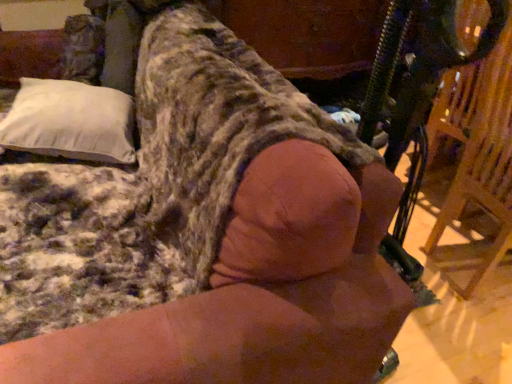
The width and height of the screenshot is (512, 384). What do you see at coordinates (70, 121) in the screenshot?
I see `white soft pillow at upper left` at bounding box center [70, 121].

Locate an element on the screen. This screenshot has width=512, height=384. white soft pillow at upper left is located at coordinates (70, 121).

Describe the element at coordinates (476, 156) in the screenshot. I see `wooden swivel chair at right` at that location.

Find the location of `wooden swivel chair at right`. wooden swivel chair at right is located at coordinates pyautogui.click(x=476, y=156).

This screenshot has width=512, height=384. Identify the location of white soft pillow at upper left. (70, 121).

Based on their positions, is white soft pillow at upper left located to the left or right of wooden swivel chair at right?

From the image, it's evident that white soft pillow at upper left is to the left of wooden swivel chair at right.

Which object is closer to the camera, white soft pillow at upper left or wooden swivel chair at right?

wooden swivel chair at right is closer to the camera.

Which is more distant, (65, 126) or (455, 128)?

The point (455, 128) is behind.

From the image's perspective, is white soft pillow at upper left below wooden swivel chair at right?

No, from the image's perspective, white soft pillow at upper left is not beneath wooden swivel chair at right.

From a real-world perspective, does white soft pillow at upper left sit lower than wooden swivel chair at right?

No.

Which object is wider, white soft pillow at upper left or wooden swivel chair at right?

With larger width is wooden swivel chair at right.

Looking at this image, which of these two, white soft pillow at upper left or wooden swivel chair at right, stands taller?

Standing taller between the two is wooden swivel chair at right.

Looking at this image, which of these two, white soft pillow at upper left or wooden swivel chair at right, is smaller?

white soft pillow at upper left is smaller.

Would you say white soft pillow at upper left is outside wooden swivel chair at right?

Yes, white soft pillow at upper left is located beyond the bounds of wooden swivel chair at right.

Based on the photo, is there a large distance between white soft pillow at upper left and wooden swivel chair at right?

Yes, white soft pillow at upper left is far from wooden swivel chair at right.

Is white soft pillow at upper left looking in the opposite direction of wooden swivel chair at right?

Correct, white soft pillow at upper left is looking away from wooden swivel chair at right.

How different are the orientations of white soft pillow at upper left and wooden swivel chair at right in degrees?

There is a 172-degree angle between the facing directions of white soft pillow at upper left and wooden swivel chair at right.

Where is `swivel chair below the white soft pillow at upper left (from a real-world perspective)`? swivel chair below the white soft pillow at upper left (from a real-world perspective) is located at coordinates (476, 156).

Which is more to the right, wooden swivel chair at right or white soft pillow at upper left?

From the viewer's perspective, wooden swivel chair at right appears more on the right side.

Does wooden swivel chair at right lie in front of white soft pillow at upper left?

Yes, wooden swivel chair at right is closer to the viewer.

Between point (506, 176) and point (96, 146), which one is positioned in front?

The point (96, 146) is more forward.

From the image's perspective, which is below, wooden swivel chair at right or white soft pillow at upper left?

wooden swivel chair at right appears lower in the image.

From a real-world perspective, is wooden swivel chair at right over white soft pillow at upper left?

No, from a real-world perspective, wooden swivel chair at right is not above white soft pillow at upper left.

Which object is wider, wooden swivel chair at right or white soft pillow at upper left?

wooden swivel chair at right is wider.

Looking at this image, who is shorter, wooden swivel chair at right or white soft pillow at upper left?

white soft pillow at upper left.

Looking at the image, does wooden swivel chair at right seem bigger or smaller compared to white soft pillow at upper left?

Considering their sizes, wooden swivel chair at right takes up more space than white soft pillow at upper left.

Is white soft pillow at upper left surrounded by wooden swivel chair at right?

Definitely not — white soft pillow at upper left is not inside wooden swivel chair at right.

Are wooden swivel chair at right and white soft pillow at upper left far apart?

Yes, wooden swivel chair at right and white soft pillow at upper left are quite far apart.

Is wooden swivel chair at right oriented towards white soft pillow at upper left?

No, wooden swivel chair at right is not oriented towards white soft pillow at upper left.

Find the location of a particular element. The height and width of the screenshot is (384, 512). swivel chair that is below the white soft pillow at upper left (from the image's perspective) is located at coordinates (476, 156).

Locate an element on the screen. The image size is (512, 384). pillow above the wooden swivel chair at right (from a real-world perspective) is located at coordinates (70, 121).

The width and height of the screenshot is (512, 384). Identify the location of swivel chair that is below the white soft pillow at upper left (from the image's perspective). (476, 156).